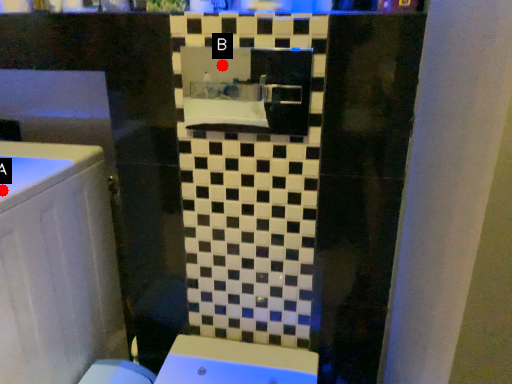
Question: Two points are circled on the image, labeled by A and B beside each circle. Which point is closer to the camera taking this photo?

Choices:
 (A) A is closer
 (B) B is closer

Answer: (A)